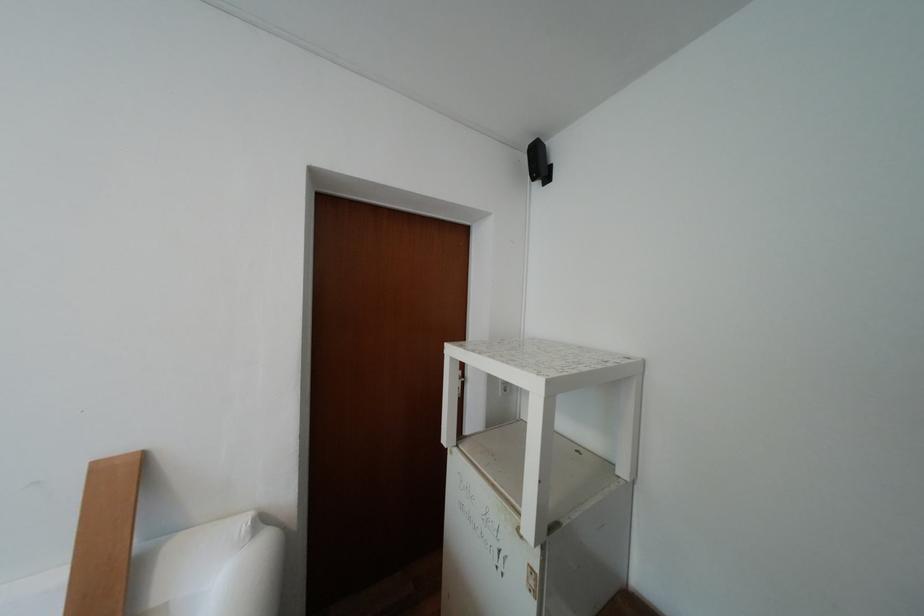
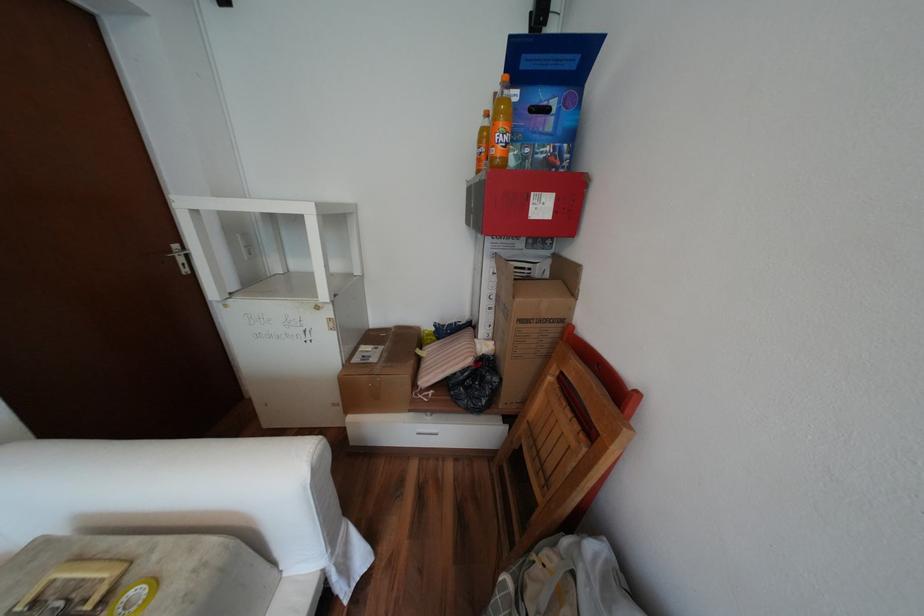
The first image is from the beginning of the video and the second image is from the end. How did the camera likely rotate when shooting the video?

The rotation direction of the camera is right-down.